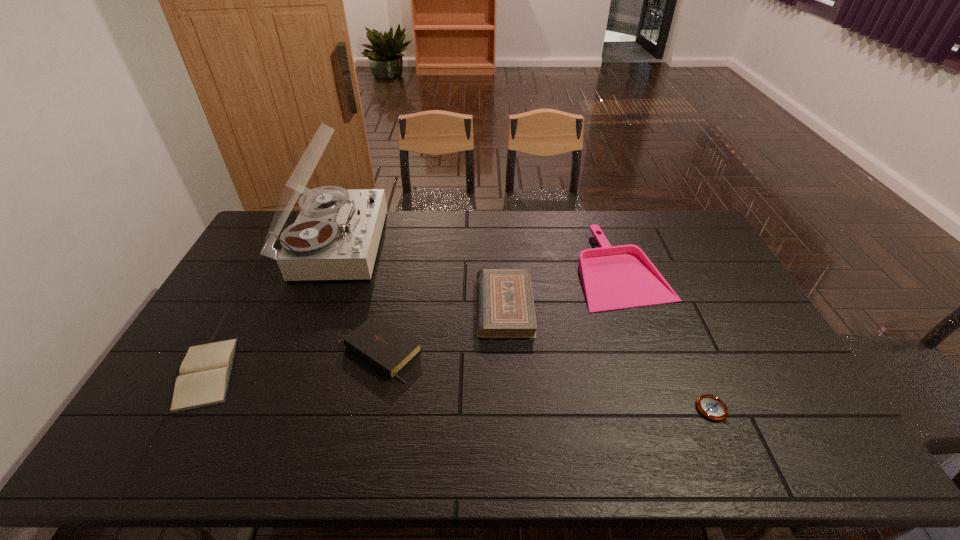
Locate an element on the screen. The image size is (960, 540). vacant space located 0.400m on the spine side of the third object from right to left is located at coordinates (349, 306).

Identify the location of vacant area situated on the spine side of the third object from right to left. This screenshot has height=540, width=960. [365, 306].

Find the location of a particular element. blank area located on the spine side of the third object from right to left is located at coordinates (432, 306).

What are the coordinates of `vacant space located on the left of the second Bible from left to right` in the screenshot? It's located at (228, 352).

Identify the location of free space located 0.140m on the back of the leftmost Bible. (245, 304).

In order to click on blank space located 0.230m on the left of the compass in this screenshot , I will do `click(606, 410)`.

At what (x,y) coordinates should I click in order to perform the action: click on record player that is at the far edge. Please return your answer as a coordinate pair (x, y). This screenshot has width=960, height=540. Looking at the image, I should click on (336, 235).

The image size is (960, 540). Find the location of `dustpan that is at the far edge`. dustpan that is at the far edge is located at coordinates (614, 277).

Locate an element on the screen. This screenshot has height=540, width=960. record player at the left edge is located at coordinates (336, 235).

Find the location of a particular element. The image size is (960, 540). Bible that is at the left edge is located at coordinates (205, 372).